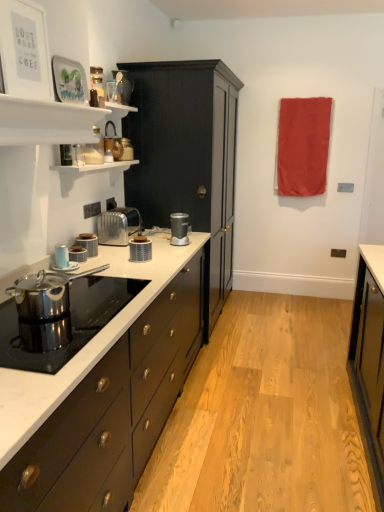
Question: From the image's perspective, is metallic silver toaster at upper left, marked as the third appliance in a top-to-bottom arrangement, located above or below white glossy shelves at upper left?

Choices:
 (A) above
 (B) below

Answer: (A)

Question: In terms of width, does metallic silver toaster at upper left, marked as the third appliance in a top-to-bottom arrangement, look wider or thinner when compared to white glossy shelves at upper left?

Choices:
 (A) wide
 (B) thin

Answer: (B)

Question: Which object is the closest to the matte silver toaster at center, the 4th kitchen appliance viewed from the left?

Choices:
 (A) metallic silver toaster at upper left, marked as the third appliance in a top-to-bottom arrangement
 (B) satin silver toaster at center
 (C) satin silver blender at center, the 1th kitchen appliance when ordered from right to left
 (D) matte black toaster at center left, the 3th kitchen appliance viewed from the left
 (E) matte black cabinet at center

Answer: (D)

Question: Which of these objects is positioned farthest from the satin silver blender at center, the fifth kitchen appliance positioned from the front?

Choices:
 (A) matte silver toaster at left, arranged as the second kitchen appliance when viewed from the left
 (B) matte glass jar at upper center, the 2th appliance viewed from the back
 (C) red fabric towel at upper right
 (D) matte silver toaster at center, the 4th kitchen appliance viewed from the left
 (E) metallic copper kettle at upper center, placed as the second appliance when sorted from bottom to top

Answer: (C)